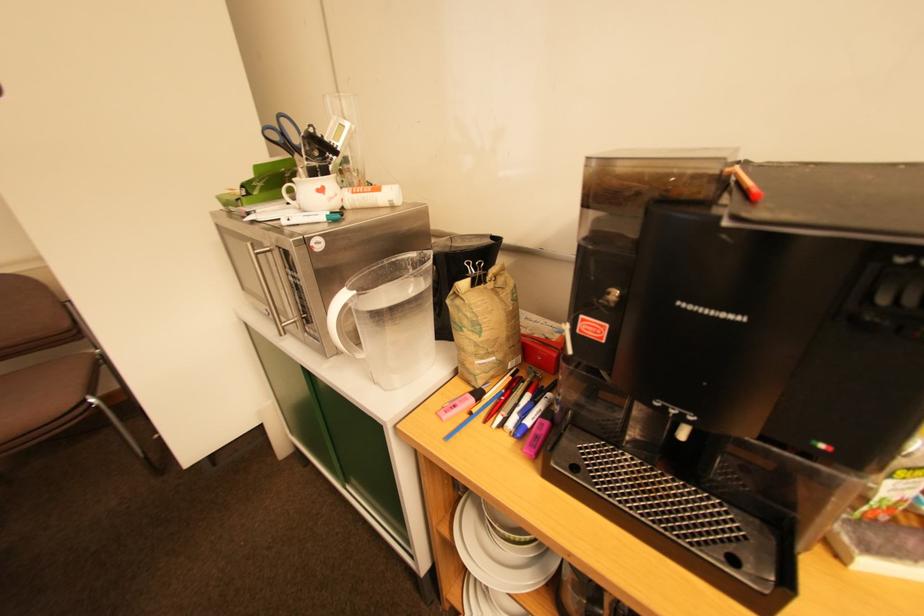
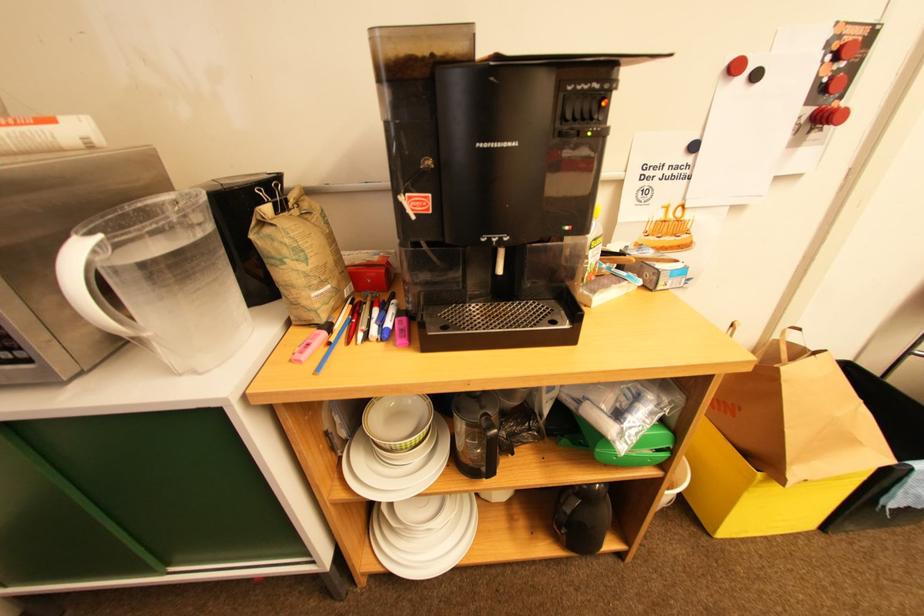
Question: The camera is either moving clockwise (left) or counter-clockwise (right) around the object. The first image is from the beginning of the video and the second image is from the end. Is the camera moving left or right when shooting the video?

Choices:
 (A) Left
 (B) Right

Answer: (A)